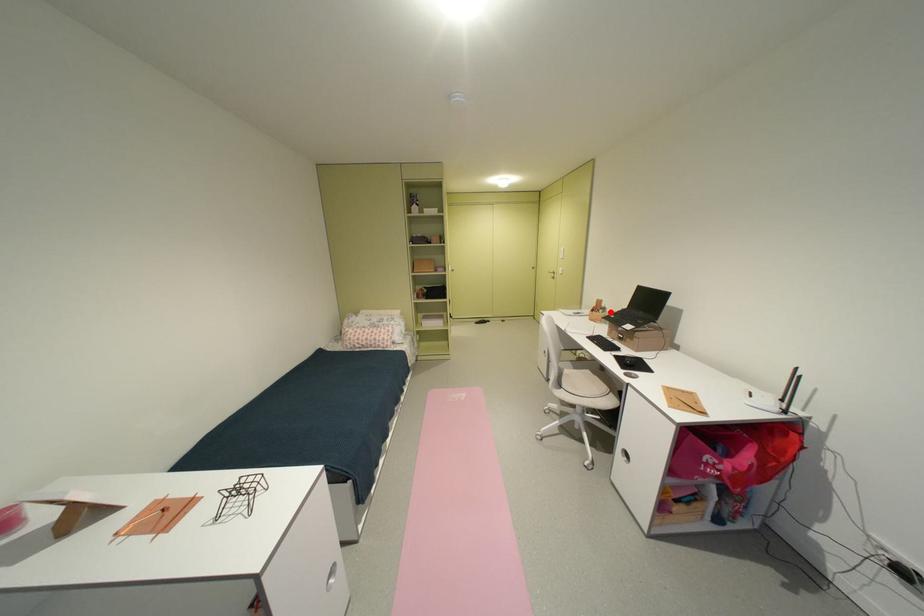
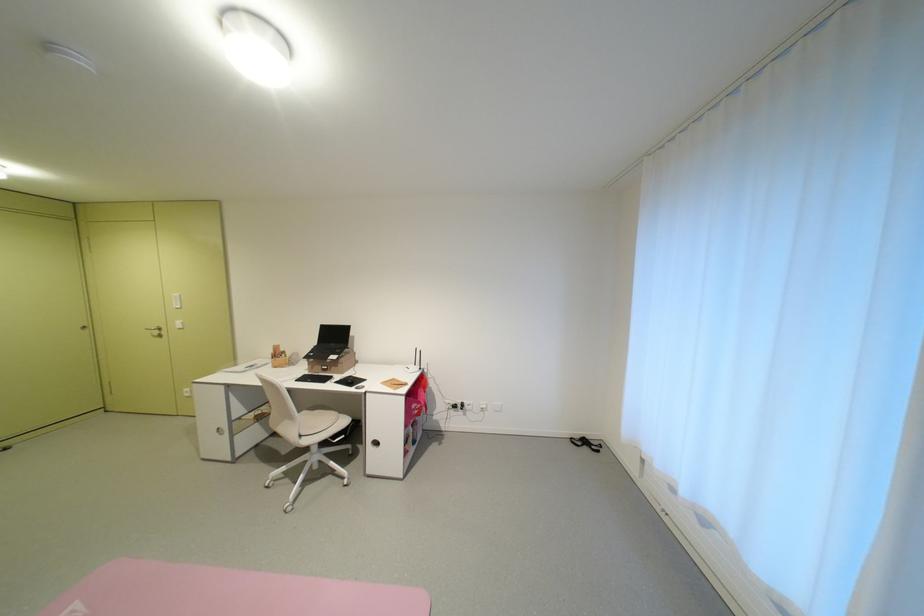
Question: A red point is marked in image1. In image2, is the corresponding 3D point closer to the camera or farther? Reply with the corresponding letter.

Choices:
 (A) The corresponding 3D point is closer.
 (B) The corresponding 3D point is farther.

Answer: (B)